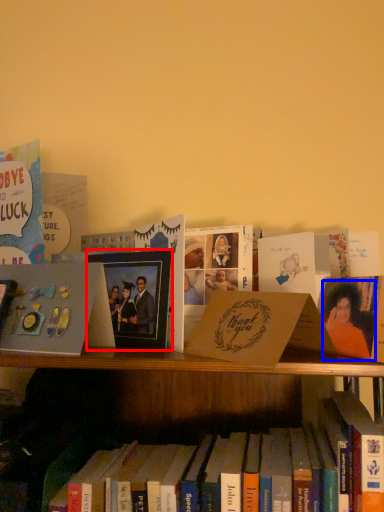
Question: Among these objects, which one is farthest to the camera, picture frame (highlighted by a red box) or person (highlighted by a blue box)?

Choices:
 (A) picture frame
 (B) person

Answer: (A)